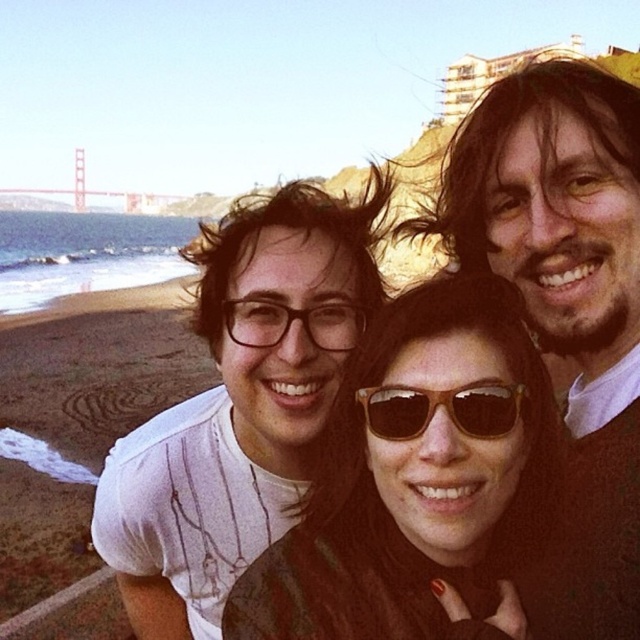
Question: Which point appears closest to the camera in this image?

Choices:
 (A) (161, 209)
 (B) (376, 433)
 (C) (257, 353)

Answer: (B)

Question: Is matte black hair at upper right smaller than metallic bridge at upper left?

Choices:
 (A) no
 (B) yes

Answer: (B)

Question: Which object is positioned closest to the white matte t-shirt at center?

Choices:
 (A) metallic bridge at upper left
 (B) brown leather jacket at center
 (C) brown wooden sunglasses at center

Answer: (B)

Question: Which point is farther from the camera taking this photo?

Choices:
 (A) (419, 424)
 (B) (456, 403)
 (C) (74, 177)

Answer: (C)

Question: Is brown leather jacket at center above matte black hair at upper right?

Choices:
 (A) no
 (B) yes

Answer: (A)

Question: Is matte black hair at upper right smaller than brown wooden sunglasses at center?

Choices:
 (A) no
 (B) yes

Answer: (A)